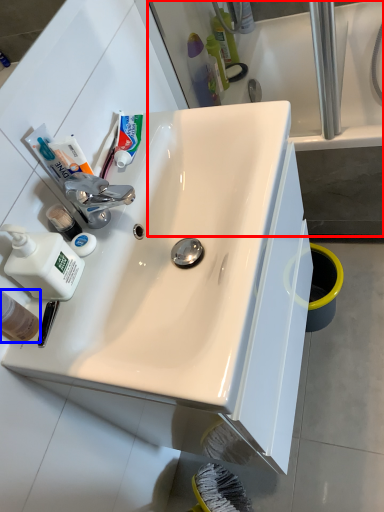
Question: Which point is further to the camera, bath (highlighted by a red box) or mouthwash (highlighted by a blue box)?

Choices:
 (A) bath
 (B) mouthwash

Answer: (A)